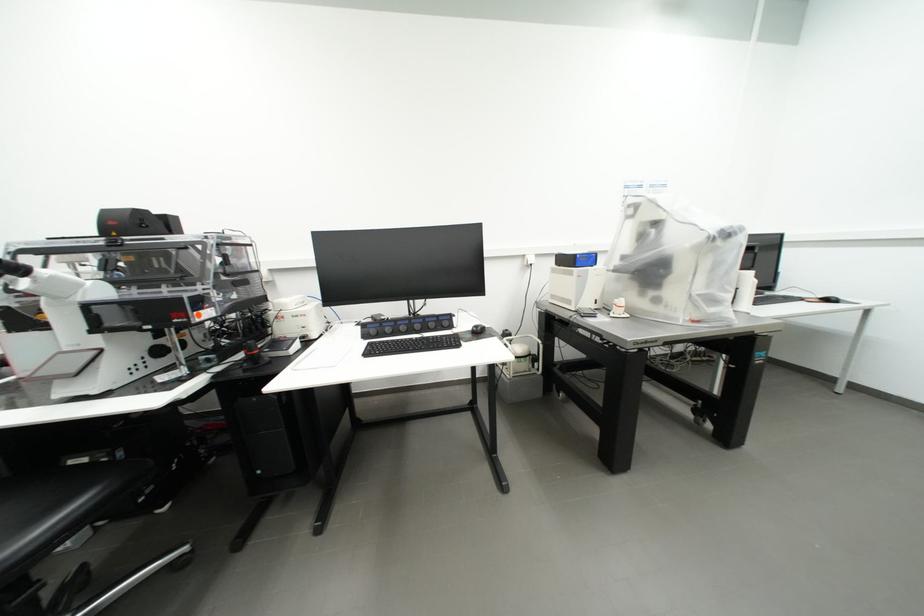
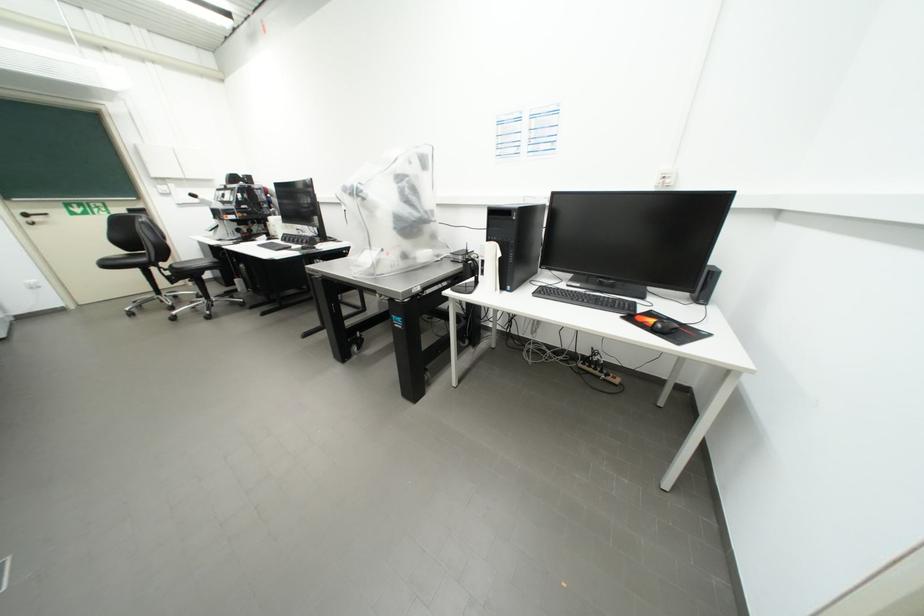
In the second image, find the point that corresponds to (711,360) in the first image.

(603, 374)